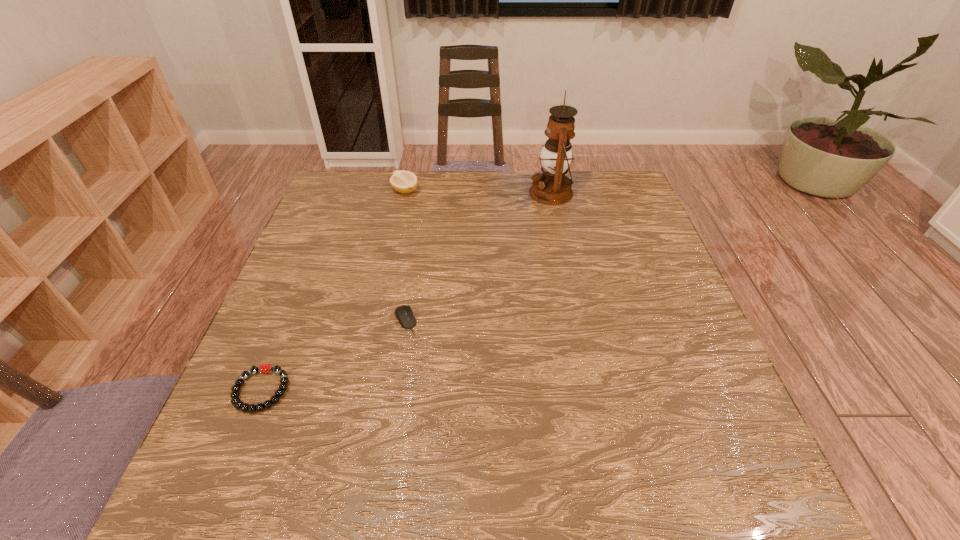
Where is `free area in between the nearest object and the rightmost object`? free area in between the nearest object and the rightmost object is located at coordinates (406, 292).

Identify the location of vacant region between the computer mouse and the rightmost object. The height and width of the screenshot is (540, 960). (478, 256).

The height and width of the screenshot is (540, 960). What are the coordinates of `empty space that is in between the third shortest object and the nearest object` in the screenshot? It's located at (333, 291).

This screenshot has height=540, width=960. Find the location of `object that can be found as the third closest to the lemon`. object that can be found as the third closest to the lemon is located at coordinates (264, 368).

Locate an element on the screen. This screenshot has width=960, height=540. the third closest object to the rightmost object is located at coordinates (264, 368).

Locate an element on the screen. free point that satisfies the following two spatial constraints: 1. on the front side of the lemon; 2. on the right side of the second nearest object is located at coordinates (376, 320).